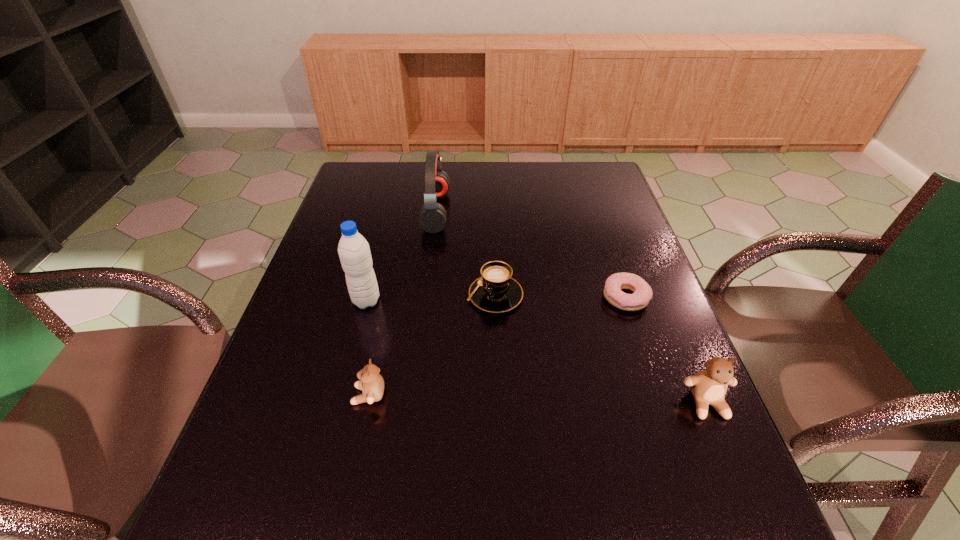
The image size is (960, 540). In order to click on the third shortest object in this screenshot , I will do `click(372, 383)`.

You are a GUI agent. You are given a task and a screenshot of the screen. Output one action in this format:
    pyautogui.click(x=<x>, y=<y>)
    Task: Click on the left teddy bear
    Image resolution: width=960 pixels, height=540 pixels.
    Given the screenshot: What is the action you would take?
    pyautogui.click(x=372, y=383)

I want to click on the fourth shortest object, so click(x=709, y=386).

Where is `the right teddy bear`? the right teddy bear is located at coordinates coord(709,386).

You are a GUI agent. You are given a task and a screenshot of the screen. Output one action in this format:
    pyautogui.click(x=<x>, y=<y>)
    Task: Click on the second tallest object
    The image size is (960, 540).
    Given the screenshot: What is the action you would take?
    pyautogui.click(x=432, y=218)

Locate an element on the screen. earphone is located at coordinates pyautogui.click(x=432, y=218).

The width and height of the screenshot is (960, 540). I want to click on water bottle, so click(x=354, y=252).

The height and width of the screenshot is (540, 960). Identify the location of the third object from right to left. (495, 291).

Identify the location of the fifth tallest object. This screenshot has width=960, height=540. 495,291.

You are a GUI agent. You are given a task and a screenshot of the screen. Output one action in this format:
    pyautogui.click(x=<x>, y=<y>)
    Task: Click on the shortest object
    The width and height of the screenshot is (960, 540).
    Given the screenshot: What is the action you would take?
    pyautogui.click(x=615, y=283)